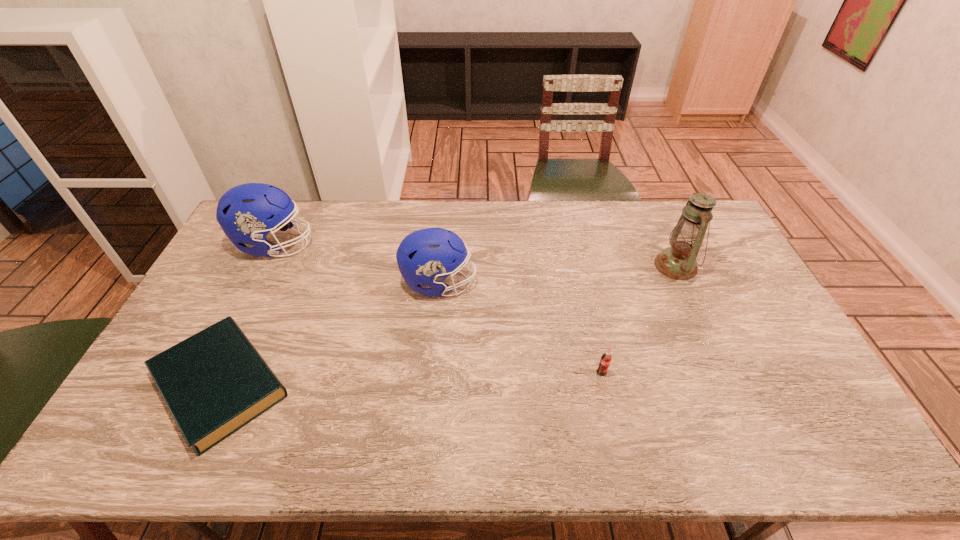
Find the location of a particular element. vacant point that satisfies the following two spatial constraints: 1. on the face guard of the left football helmet; 2. on the right side of the shortest object is located at coordinates (205, 384).

Find the location of a particular element. This screenshot has width=960, height=540. vacant region that satisfies the following two spatial constraints: 1. on the face guard of the left football helmet; 2. on the back side of the rightmost object is located at coordinates (265, 266).

The image size is (960, 540). What are the coordinates of `free space that satisfies the following two spatial constraints: 1. on the face guard of the shortest object; 2. on the left side of the left football helmet` in the screenshot? It's located at (205, 384).

Find the location of a particular element. The width and height of the screenshot is (960, 540). free spot that satisfies the following two spatial constraints: 1. on the back side of the rightmost object; 2. on the face guard of the left football helmet is located at coordinates (666, 245).

Identify the location of vacant point that satisfies the following two spatial constraints: 1. on the front-facing side of the shorter football helmet; 2. on the front side of the shortest object. (430, 384).